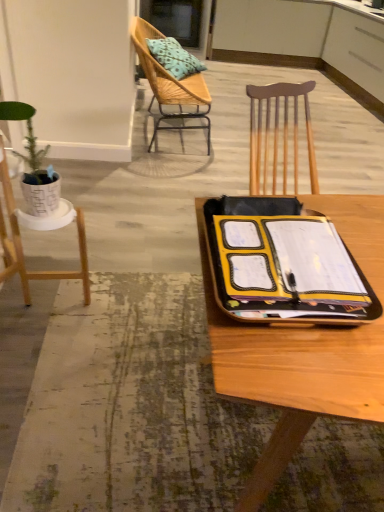
Question: Considering the relative positions of woven wood chair at upper left, which is counted as the second chair, starting from the front, and yellow matte notebook at center in the image provided, is woven wood chair at upper left, which is counted as the second chair, starting from the front, behind yellow matte notebook at center?

Choices:
 (A) no
 (B) yes

Answer: (B)

Question: Can you see woven wood chair at upper left, the second chair from the bottom, touching yellow matte notebook at center?

Choices:
 (A) yes
 (B) no

Answer: (B)

Question: Is woven wood chair at upper left, which is the first chair in top-to-bottom order, oriented towards yellow matte notebook at center?

Choices:
 (A) no
 (B) yes

Answer: (A)

Question: From a real-world perspective, is woven wood chair at upper left, which is counted as the second chair, starting from the front, positioned under yellow matte notebook at center based on gravity?

Choices:
 (A) yes
 (B) no

Answer: (A)

Question: Is woven wood chair at upper left, which is counted as the second chair, starting from the front, far from yellow matte notebook at center?

Choices:
 (A) yes
 (B) no

Answer: (A)

Question: From a real-world perspective, is white matte plant stand at left, the second chair when ordered from back to front, physically located above or below woven wood chair at upper left, the 1th chair positioned from the back?

Choices:
 (A) above
 (B) below

Answer: (B)

Question: From the image's perspective, relative to woven wood chair at upper left, the 1th chair positioned from the back, is white matte plant stand at left, the second chair when ordered from back to front, above or below?

Choices:
 (A) above
 (B) below

Answer: (B)

Question: From their relative heights in the image, would you say white matte plant stand at left, acting as the first chair starting from the bottom, is taller or shorter than woven wood chair at upper left, the 1th chair positioned from the back?

Choices:
 (A) short
 (B) tall

Answer: (A)

Question: In terms of size, does white matte plant stand at left, the second chair when ordered from back to front, appear bigger or smaller than woven wood chair at upper left, the 1th chair positioned from the back?

Choices:
 (A) small
 (B) big

Answer: (A)

Question: From the image's perspective, is green matte plant pot at left positioned above or below white matte plant stand at left, which is counted as the second chair, starting from the top?

Choices:
 (A) below
 (B) above

Answer: (B)

Question: From a real-world perspective, is green matte plant pot at left above or below white matte plant stand at left, acting as the first chair starting from the bottom?

Choices:
 (A) above
 (B) below

Answer: (A)

Question: Based on their positions, is green matte plant pot at left located to the left or right of white matte plant stand at left, which is counted as the second chair, starting from the top?

Choices:
 (A) left
 (B) right

Answer: (B)

Question: Based on their sizes in the image, would you say green matte plant pot at left is bigger or smaller than white matte plant stand at left, the 1th chair positioned from the front?

Choices:
 (A) small
 (B) big

Answer: (A)

Question: Is point (152, 45) closer or farther from the camera than point (41, 204)?

Choices:
 (A) closer
 (B) farther

Answer: (B)

Question: Considering their positions, is blue patterned cushion at upper center located in front of or behind green matte plant pot at left?

Choices:
 (A) front
 (B) behind

Answer: (B)